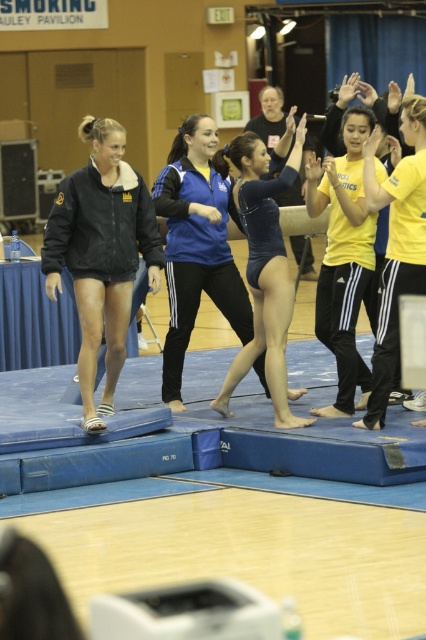
In the scene shown: You are a photographer trying to capture a clear shot of both the black fleece jacket at left and the blue leotard at center. Given their sizes, which one should you focus on first to ensure it doesn

The black fleece jacket at left occupies less space than the blue leotard at center, so you should focus on the blue leotard at center first since it is larger and will require more attention to capture clearly.

You are a photographer setting up for a group photo in the gymnasium. You need to arrange the black fleece jacket at left and the yellow matte athletic top at right so that both fit within the camera frame. Considering their sizes, which clothing item requires more horizontal space?

The black fleece jacket at left requires more horizontal space because its width surpasses that of the yellow matte athletic top at right.

Where is the yellow matte athletic top at right located in the image?

The yellow matte athletic top at right is located at point (344, 257) in the image.